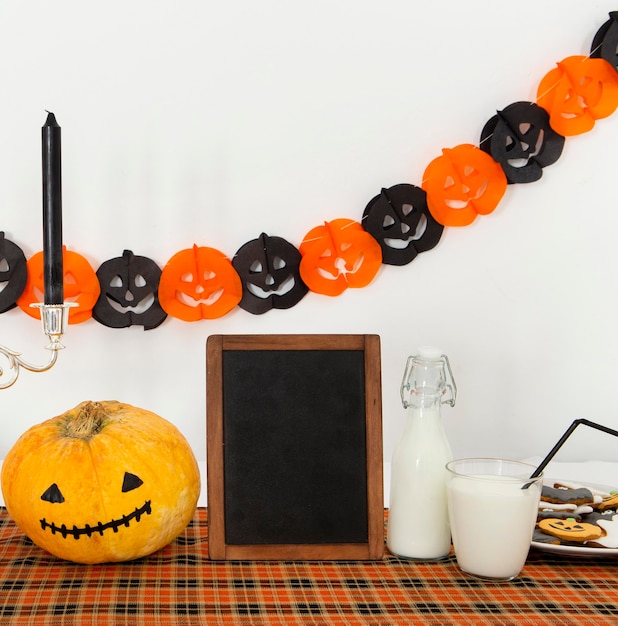
Identify the location of orange paper pumpkin. This screenshot has height=626, width=618. (78, 280), (212, 270), (342, 254), (485, 190), (595, 113).